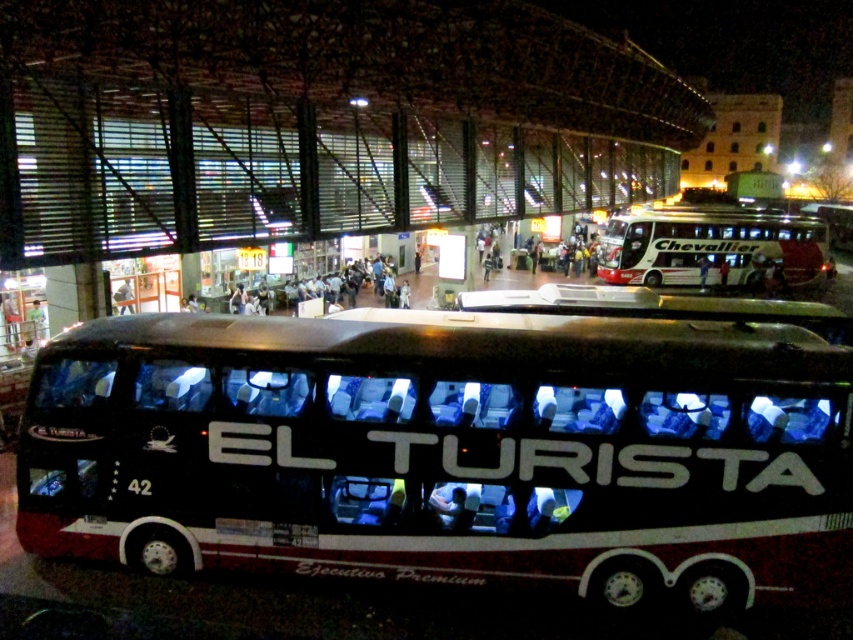
Is point (436, 538) behind point (740, 237)?

No, it is not.

What do you see at coordinates (450, 452) in the screenshot? This screenshot has height=640, width=853. I see `black matte bus at center` at bounding box center [450, 452].

Between point (326, 324) and point (606, 241), which one is positioned behind?

The point (606, 241) is behind.

Find the location of `black matte bus at center`. black matte bus at center is located at coordinates (450, 452).